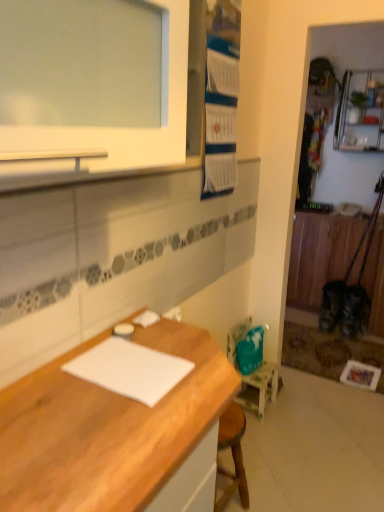
The height and width of the screenshot is (512, 384). What are the coordinates of `vacant area situated below white paper at center (from a real-world perspective)` in the screenshot? It's located at (134, 366).